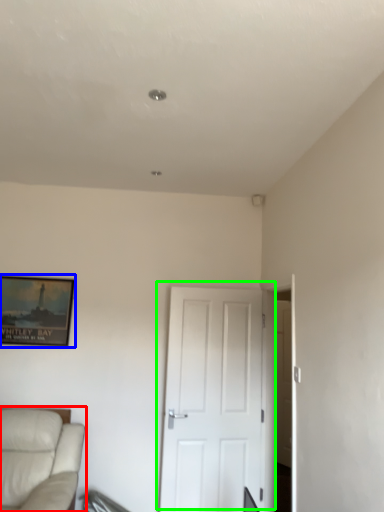
Question: Which object is the closest to the studio couch (highlighted by a red box)? Choose among these: picture frame (highlighted by a blue box) or door (highlighted by a green box).

Choices:
 (A) picture frame
 (B) door

Answer: (A)